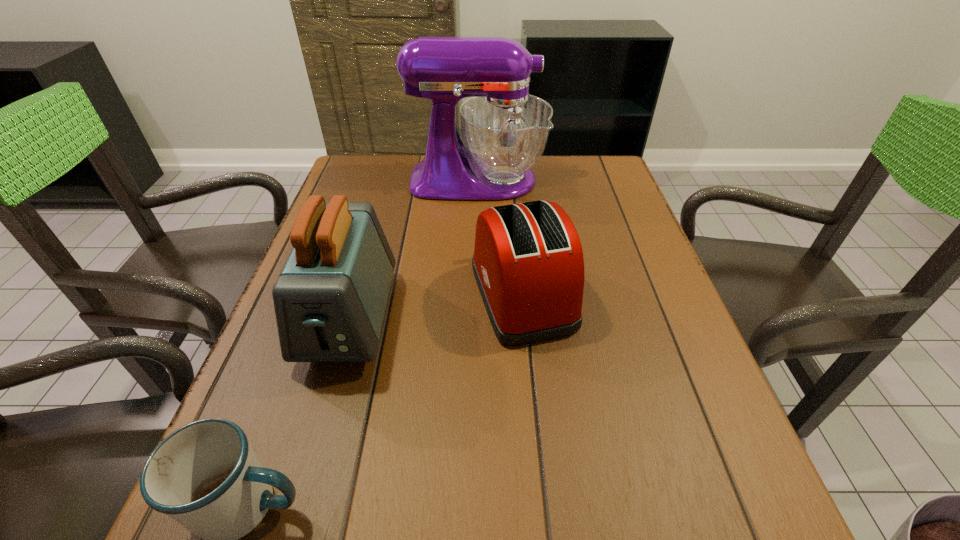
At what (x,y) coordinates should I click in order to perform the action: click on mixer. Please return your answer as a coordinate pair (x, y). This screenshot has width=960, height=540. Looking at the image, I should click on (505, 130).

Locate an element on the screen. the tallest object is located at coordinates (505, 130).

Find the location of a particular element. Image resolution: width=960 pixels, height=540 pixels. the second tallest object is located at coordinates (330, 299).

Locate an element on the screen. The width and height of the screenshot is (960, 540). the taller toaster is located at coordinates (330, 299).

The image size is (960, 540). Identify the location of the third tallest object. (528, 264).

Identify the location of the shorter toaster. This screenshot has width=960, height=540. (528, 264).

At what (x,y) coordinates should I click in order to perform the action: click on vacant space located 0.060m at the bowl opening of the tallest object. Please return your answer as a coordinate pair (x, y). Looking at the image, I should click on (564, 180).

Locate an element on the screen. The image size is (960, 540). blank space located on the front-facing side of the taller toaster is located at coordinates (291, 521).

This screenshot has height=540, width=960. I want to click on free space located on the left of the right toaster, so click(x=324, y=294).

This screenshot has height=540, width=960. Identify the location of object that is positioned at the far edge. (505, 130).